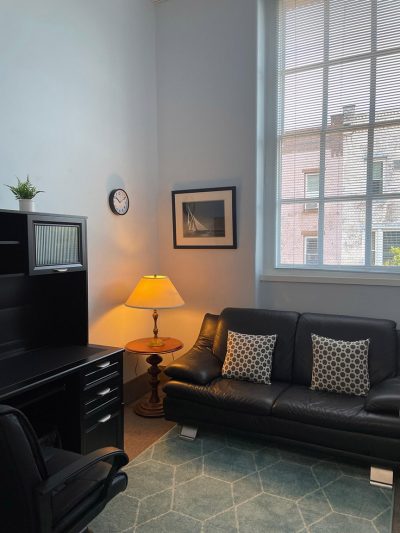
Locate an element on the screen. left sofa leg is located at coordinates (191, 435).